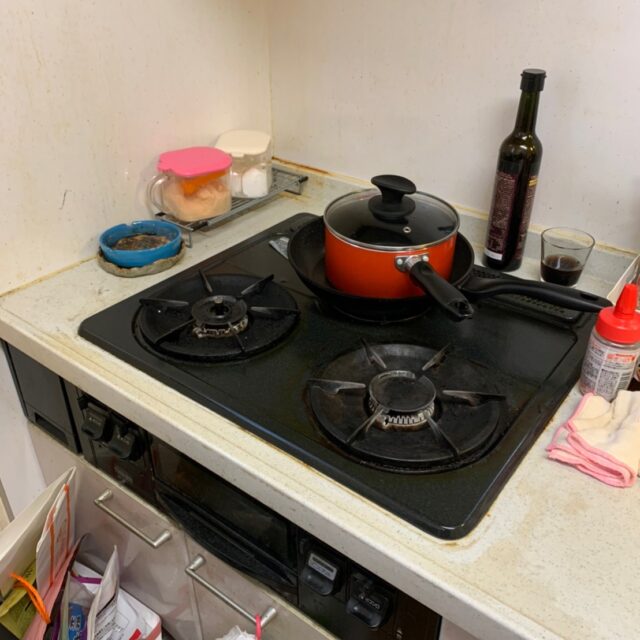
Identify the location of ash tray. The height and width of the screenshot is (640, 640). (150, 243).